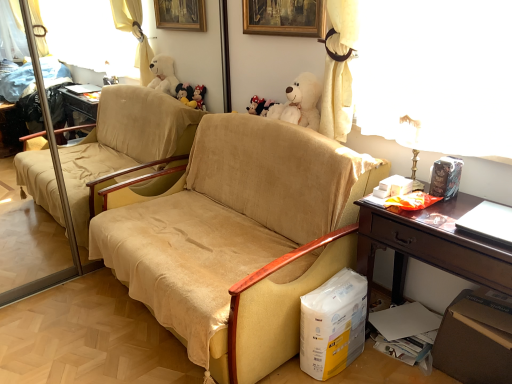
The width and height of the screenshot is (512, 384). What do you see at coordinates (476, 338) in the screenshot? I see `brown cardboard box at lower right` at bounding box center [476, 338].

This screenshot has width=512, height=384. Find the location of `beige fabric chair at center`. beige fabric chair at center is located at coordinates click(x=240, y=239).

What do you see at coordinates (240, 239) in the screenshot? I see `beige fabric chair at center` at bounding box center [240, 239].

This screenshot has width=512, height=384. What do you see at coordinates (300, 102) in the screenshot? I see `white plush bear at upper center` at bounding box center [300, 102].

Find the location of a particular element. Image resolution: width=512 pixels, height=384 pixels. brown wooden desk at right is located at coordinates (431, 245).

Can you tell me how much beige fabric chair at center and brown wooden desk at right differ in facing direction?

They differ by 0.099 degrees in their facing directions.

The image size is (512, 384). Identify the location of chair that appears above the brown wooden desk at right (from the image's perspective). (240, 239).

Is beige fabric chair at center further to camera compared to brown wooden desk at right?

No.

Is brown wooden desk at right shorter than beige fabric chair at center?

Correct, brown wooden desk at right is not as tall as beige fabric chair at center.

Does brown wooden desk at right appear on the right side of beige fabric chair at center?

Yes.

Considering the positions of points (489, 337) and (247, 182), is point (489, 337) farther from camera compared to point (247, 182)?

No, (489, 337) is closer to viewer.

From a real-world perspective, which is physically above, white plush bear at upper center or beige fabric chair at center?

white plush bear at upper center, from a real-world perspective.

Is point (289, 101) closer or farther from the camera than point (323, 148)?

Point (289, 101) is positioned farther from the camera compared to point (323, 148).

Is white plush bear at upper center to the left of beige fabric chair at center from the viewer's perspective?

No.

Does brown cardboard box at lower right lie in front of brown wooden desk at right?

No.

Is brown cardboard box at lower right thinner than brown wooden desk at right?

Indeed, brown cardboard box at lower right has a lesser width compared to brown wooden desk at right.

Where is `box behind the brown wooden desk at right`? The width and height of the screenshot is (512, 384). box behind the brown wooden desk at right is located at coordinates (476, 338).

From the image's perspective, is brown cardboard box at lower right located above white plush bear at upper center?

Actually, brown cardboard box at lower right appears below white plush bear at upper center in the image.

Is brown cardboard box at lower right looking in the opposite direction of white plush bear at upper center?

No, brown cardboard box at lower right is not facing the opposite direction of white plush bear at upper center.

Is brown cardboard box at lower right thinner than white plush bear at upper center?

No.

How different are the orientations of brown wooden desk at right and white plush bear at upper center in degrees?

The facing directions of brown wooden desk at right and white plush bear at upper center are 3.04 degrees apart.

Is brown wooden desk at right to the left of white plush bear at upper center from the viewer's perspective?

No.

Is there a large distance between brown wooden desk at right and white plush bear at upper center?

No, brown wooden desk at right is not far away from white plush bear at upper center.

Can you confirm if brown wooden desk at right is bigger than white plush bear at upper center?

Correct, brown wooden desk at right is larger in size than white plush bear at upper center.

Is beige fabric chair at center to the left of white plush bear at upper center from the viewer's perspective?

Yes, beige fabric chair at center is to the left of white plush bear at upper center.

Can you confirm if beige fabric chair at center is taller than white plush bear at upper center?

Indeed, beige fabric chair at center has a greater height compared to white plush bear at upper center.

Does beige fabric chair at center have a smaller size compared to white plush bear at upper center?

Actually, beige fabric chair at center might be larger than white plush bear at upper center.

Would you say white plush bear at upper center is part of beige fabric chair at center's contents?

Indeed, white plush bear at upper center is located within beige fabric chair at center.

Where is `chair located above the brown wooden desk at right (from the image's perspective)`? This screenshot has width=512, height=384. chair located above the brown wooden desk at right (from the image's perspective) is located at coordinates (240, 239).

At what (x,y) coordinates should I click in order to perform the action: click on desk below the beige fabric chair at center (from a real-world perspective). Please return your answer as a coordinate pair (x, y). Looking at the image, I should click on (431, 245).

In the scene shown: When comparing their distances from white plush bear at upper center, does brown cardboard box at lower right or brown wooden desk at right seem further?

Among the two, brown cardboard box at lower right is located further to white plush bear at upper center.

When comparing their distances from beige fabric chair at center, does white plush bear at upper center or brown wooden desk at right seem further?

Based on the image, white plush bear at upper center appears to be further to beige fabric chair at center.

Looking at the image, which one is located closer to white plush bear at upper center, beige fabric chair at center or brown wooden desk at right?

Based on the image, beige fabric chair at center appears to be nearer to white plush bear at upper center.

When comparing their distances from brown cardboard box at lower right, does white plush bear at upper center or beige fabric chair at center seem closer?

Based on the image, beige fabric chair at center appears to be nearer to brown cardboard box at lower right.

From the image, which object appears to be farther from brown cardboard box at lower right, white plush bear at upper center or brown wooden desk at right?

white plush bear at upper center is further to brown cardboard box at lower right.

From the image, which object appears to be farther from white plush bear at upper center, brown wooden desk at right or beige fabric chair at center?

brown wooden desk at right.

Considering their positions, is brown cardboard box at lower right positioned closer to beige fabric chair at center than brown wooden desk at right?

Result: brown wooden desk at right.

Based on their spatial positions, is beige fabric chair at center or brown cardboard box at lower right closer to brown wooden desk at right?

Based on the image, brown cardboard box at lower right appears to be nearer to brown wooden desk at right.

This screenshot has width=512, height=384. What are the coordinates of `toy between beige fabric chair at center and brown wooden desk at right in the horizontal direction` in the screenshot? It's located at (300, 102).

At what (x,y) coordinates should I click in order to perform the action: click on desk situated between beige fabric chair at center and brown cardboard box at lower right from left to right. Please return your answer as a coordinate pair (x, y). This screenshot has width=512, height=384. Looking at the image, I should click on (431, 245).

Locate an element on the screen. This screenshot has width=512, height=384. desk between white plush bear at upper center and brown cardboard box at lower right vertically is located at coordinates (431, 245).

Find the location of `toy between beige fabric chair at center and brown cardboard box at lower right`. toy between beige fabric chair at center and brown cardboard box at lower right is located at coordinates (300, 102).